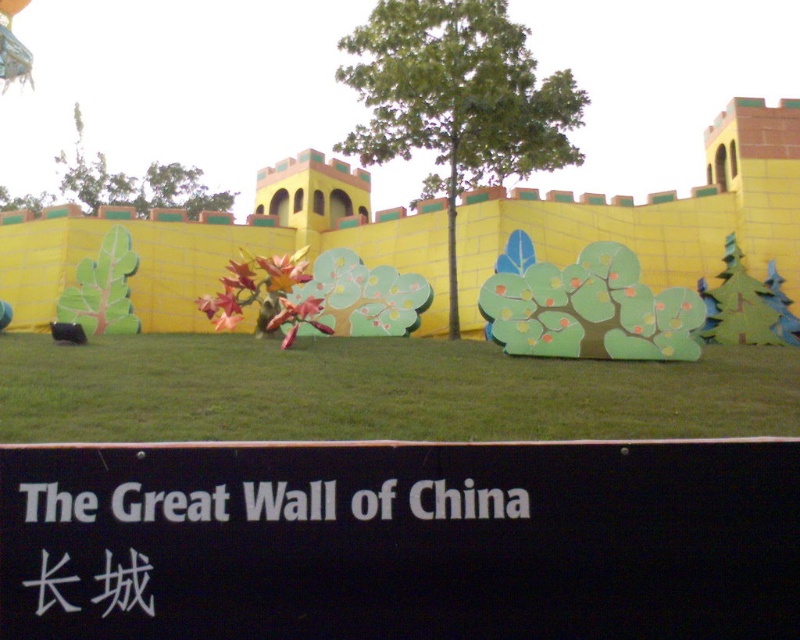
Question: Is black plastic sign at lower center above green grass at center?

Choices:
 (A) no
 (B) yes

Answer: (A)

Question: Does black plastic sign at lower center appear on the right side of white plastic sign at center?

Choices:
 (A) yes
 (B) no

Answer: (A)

Question: Considering the real-world distances, which object is closest to the black plastic sign at lower center?

Choices:
 (A) white plastic sign at center
 (B) green grass at center

Answer: (A)

Question: Can you confirm if green grass at center is positioned to the right of green leafy tree at center?

Choices:
 (A) no
 (B) yes

Answer: (A)

Question: Which point appears closest to the camera in this image?

Choices:
 (A) (794, 416)
 (B) (474, 170)
 (C) (96, 204)

Answer: (A)

Question: Which of the following is the farthest from the observer?

Choices:
 (A) (504, 509)
 (B) (472, 144)

Answer: (B)